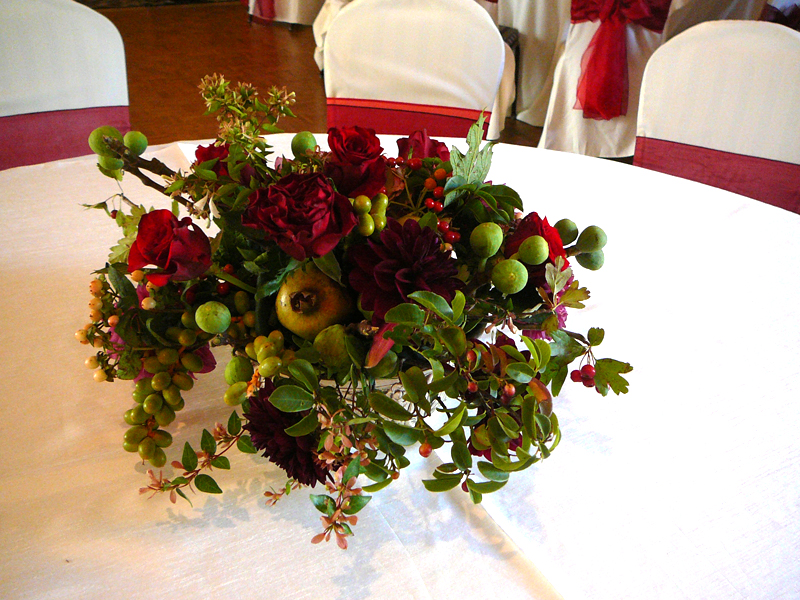
Identify the location of floor. (212, 48).